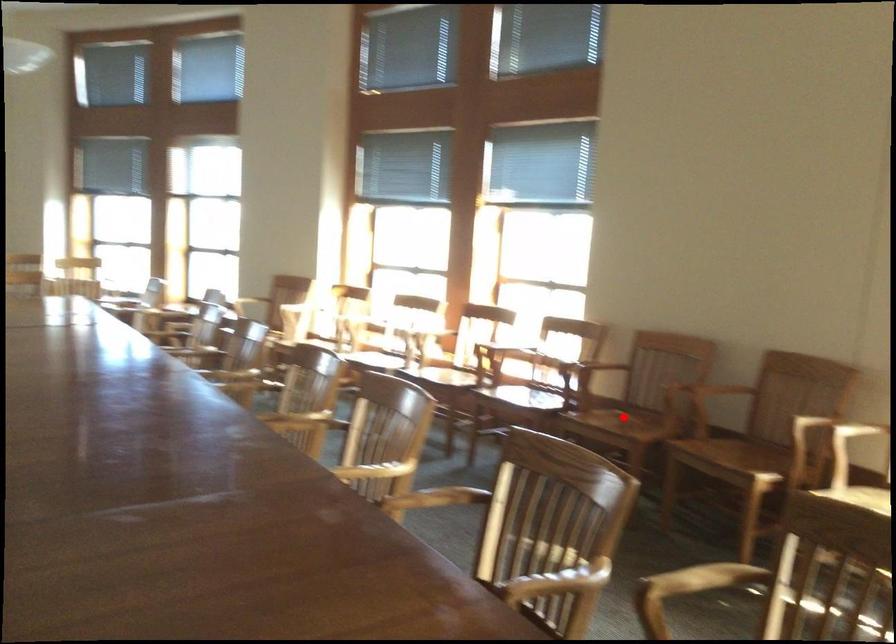
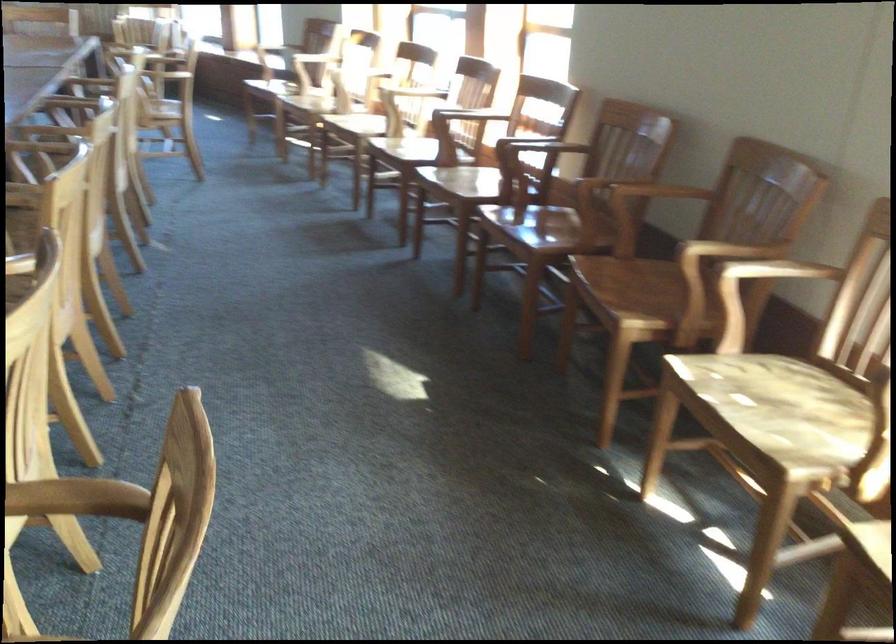
Find the pixel in the second image that matches the highlighted location in the first image.

(531, 230)